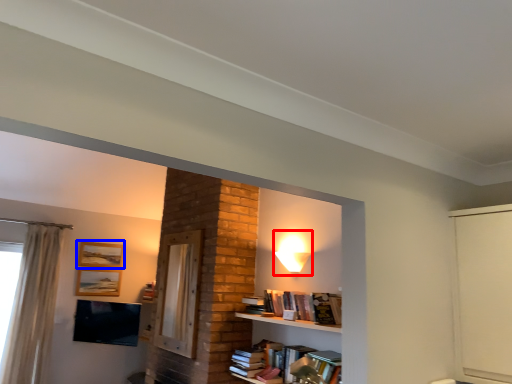
Question: Which point is closer to the camera, lamp (highlighted by a red box) or picture frame (highlighted by a blue box)?

Choices:
 (A) lamp
 (B) picture frame

Answer: (A)